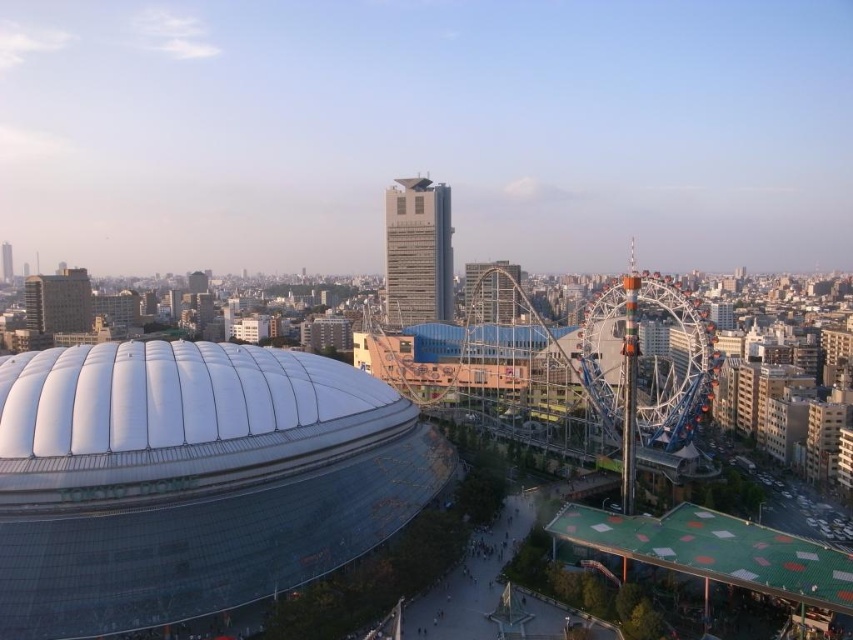
You are planning to take a photo of the transparent glass dome at center and the multicolored metallic ferris wheel at right from a distance. Which object will appear bigger in your photo?

The transparent glass dome at center will appear bigger in the photo because it is larger in size than the multicolored metallic ferris wheel at right.

You are a city planner evaluating the urban layout. Given the transparent glass dome at center and the multicolored metallic ferris wheel at right, which one is positioned higher in the image?

The transparent glass dome at center is located above the multicolored metallic ferris wheel at right, so it is positioned higher in the image.

You are a city planner assessing the feasibility of installing a new 50 meter wide pedestrian bridge between the transparent glass dome at center and the multicolored metallic ferris wheel at right. Based on the distance between them, will the bridge fit without requiring any structural modifications to the existing buildings?

The transparent glass dome at center and multicolored metallic ferris wheel at right are 45.72 meters apart. Since the proposed bridge is 50 meters wide, it would exceed the available space between them by 4.28 meters. Therefore, the bridge cannot be installed without adjustments to the existing structures to accommodate the width.